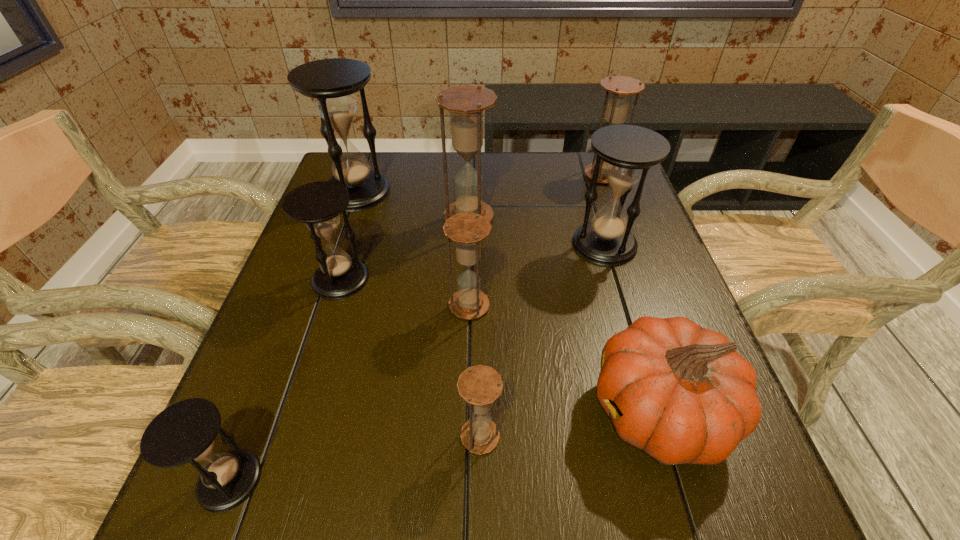
Locate an element on the screen. This screenshot has width=960, height=540. free spot between the smallest brown hourglass and the smallest black hourglass is located at coordinates (355, 458).

Locate an element on the screen. This screenshot has height=540, width=960. empty location between the second smallest brown hourglass and the farthest brown hourglass is located at coordinates (536, 240).

Locate which object is the eighth closest to the farthest black hourglass. Please provide its 2D coordinates. Your answer should be formatted as a tuple, i.e. [(x, y)], where the tuple contains the x and y coordinates of a point satisfying the conditions above.

[(185, 432)]

Point out which object is positioned as the sixth nearest to the smallest brown hourglass. Please provide its 2D coordinates. Your answer should be formatted as a tuple, i.e. [(x, y)], where the tuple contains the x and y coordinates of a point satisfying the conditions above.

[(466, 103)]

Select which hourglass is the sixth closest to the rightmost black hourglass. Please provide its 2D coordinates. Your answer should be formatted as a tuple, i.e. [(x, y)], where the tuple contains the x and y coordinates of a point satisfying the conditions above.

[(332, 82)]

Image resolution: width=960 pixels, height=540 pixels. Find the location of `the fifth closest hourglass relative to the pumpkin`. the fifth closest hourglass relative to the pumpkin is located at coordinates (319, 204).

Identify which brown hourglass is located as the fourth nearest to the orange pumpkin. Please provide its 2D coordinates. Your answer should be formatted as a tuple, i.e. [(x, y)], where the tuple contains the x and y coordinates of a point satisfying the conditions above.

[(620, 88)]

The height and width of the screenshot is (540, 960). Identify the location of the closest brown hourglass to the pumpkin. pos(480,386).

Locate which black hourglass is the third closest to the rightmost brown hourglass. Please provide its 2D coordinates. Your answer should be formatted as a tuple, i.e. [(x, y)], where the tuple contains the x and y coordinates of a point satisfying the conditions above.

[(319, 204)]

Where is `black hourglass that is the nearest to the farthest black hourglass`? black hourglass that is the nearest to the farthest black hourglass is located at coordinates (319, 204).